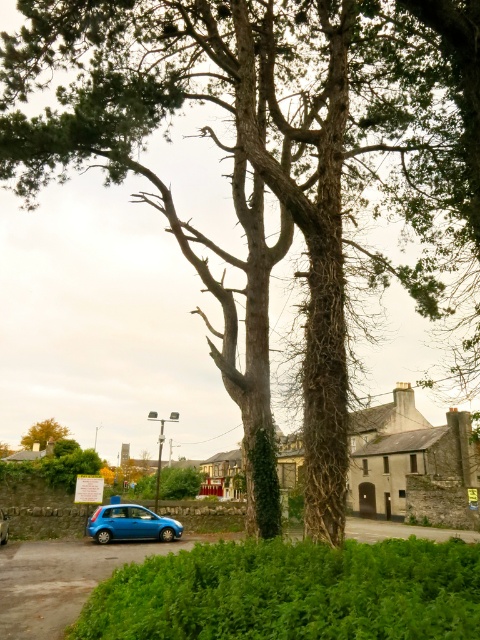
You are a gardener who needs to trim both the green leafy hedge at lower center and the brown rough tree at lower left. Based on their sizes, which one will require more time to trim?

The brown rough tree at lower left will require more time to trim since it is larger than the green leafy hedge at lower center.

You are standing at the point labeled as point (291, 593) in the image. Looking around, you see a large tree with mossy trunk and a blue car parked somewhere. Which object is closer to your current position?

The point (291, 593) is on the green leafy hedge at lower center, so the green leafy hedge at lower center is closer to your current position than the blue car parked on the left side of the frame.

You are a pedestrian standing at the edge of the scene and want to walk from the green leafy hedge at lower center to the blue matte car at lower left. Which direction should you move to reach the car?

The green leafy hedge at lower center is positioned over the blue matte car at lower left, so to reach the car, you should move downward from the hedge towards the lower left direction.